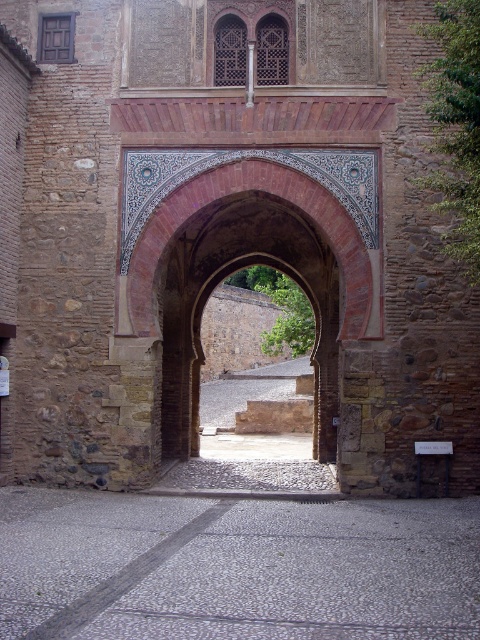
Does gray stone courtyard at center come in front of terracotta brick archway at center?

That is True.

Is gray stone courtyard at center smaller than terracotta brick archway at center?

Correct, gray stone courtyard at center occupies less space than terracotta brick archway at center.

The image size is (480, 640). Find the location of `gray stone courtyard at center`. gray stone courtyard at center is located at coordinates (238, 566).